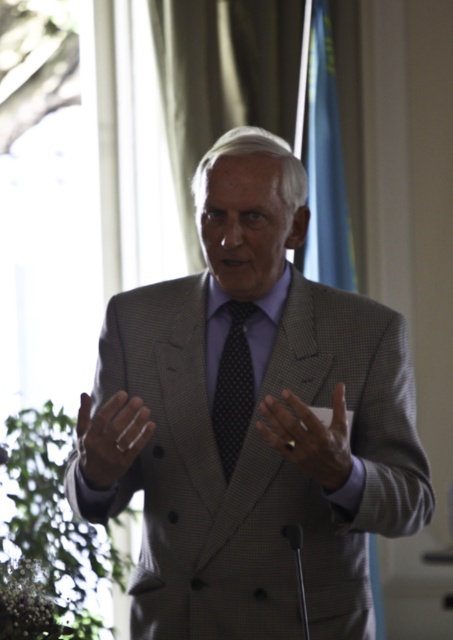
Can you confirm if clear plastic ring at center is wider than black dotted tie at center?

Correct, the width of clear plastic ring at center exceeds that of black dotted tie at center.

Which is more to the right, clear plastic ring at center or black dotted tie at center?

Positioned to the right is black dotted tie at center.

Between point (129, 397) and point (227, 310), which one is positioned behind?

The point (227, 310) is more distant.

Locate an element on the screen. The height and width of the screenshot is (640, 453). clear plastic ring at center is located at coordinates (110, 436).

Between gray textured suit at center and smooth gray suit at center, which one appears on the right side from the viewer's perspective?

From the viewer's perspective, smooth gray suit at center appears more on the right side.

Can you confirm if gray textured suit at center is shorter than smooth gray suit at center?

No.

Describe the element at coordinates (259, 422) in the screenshot. The width and height of the screenshot is (453, 640). I see `gray textured suit at center` at that location.

Locate an element on the screen. The height and width of the screenshot is (640, 453). gray textured suit at center is located at coordinates (259, 422).

Is gray textured suit at center taller than black dotted tie at center?

Correct, gray textured suit at center is much taller as black dotted tie at center.

Does gray textured suit at center appear on the left side of black dotted tie at center?

No, gray textured suit at center is not to the left of black dotted tie at center.

Find the location of a particular element. The image size is (453, 640). gray textured suit at center is located at coordinates (259, 422).